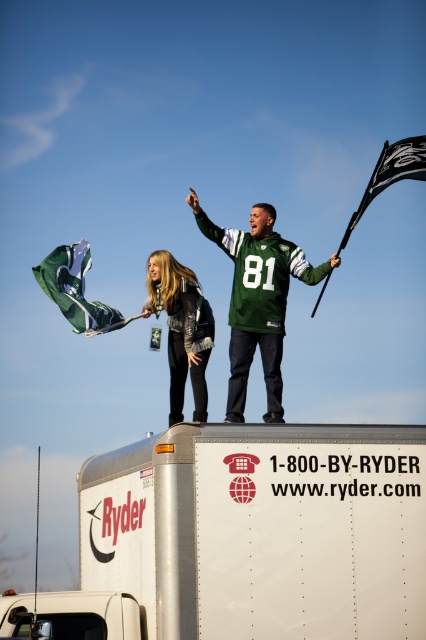
Who is lower down, leather jacket at center or black fabric flag at upper right?

leather jacket at center is below.

Describe the element at coordinates (181, 328) in the screenshot. I see `leather jacket at center` at that location.

Which is in front, point (172, 404) or point (385, 173)?

Point (172, 404) is more forward.

Where is `leather jacket at center`? The image size is (426, 640). leather jacket at center is located at coordinates (181, 328).

Can you confirm if white matte ryder truck at lower center is thinner than leather jacket at center?

Incorrect, white matte ryder truck at lower center's width is not less than leather jacket at center's.

Is point (236, 582) more distant than point (173, 369)?

No.

The image size is (426, 640). Identify the location of white matte ryder truck at lower center. (261, 531).

Is point (337, 545) more distant than point (69, 259)?

No, (337, 545) is in front of (69, 259).

Can you confirm if white matte ryder truck at lower center is positioned to the left of green fabric flag at upper center?

In fact, white matte ryder truck at lower center is to the right of green fabric flag at upper center.

Which is in front, point (371, 548) or point (62, 300)?

Point (371, 548) is in front.

In order to click on white matte ryder truck at lower center in this screenshot , I will do `click(261, 531)`.